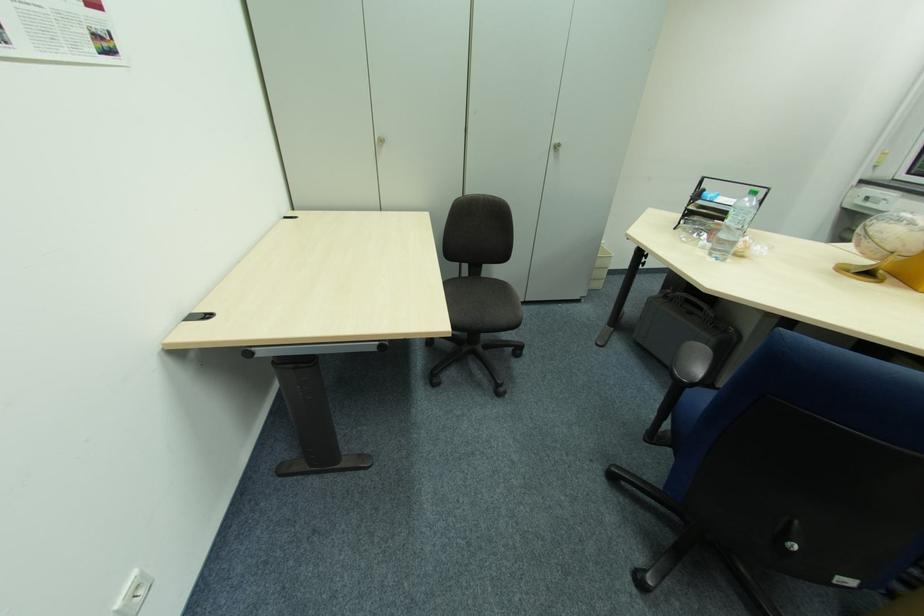
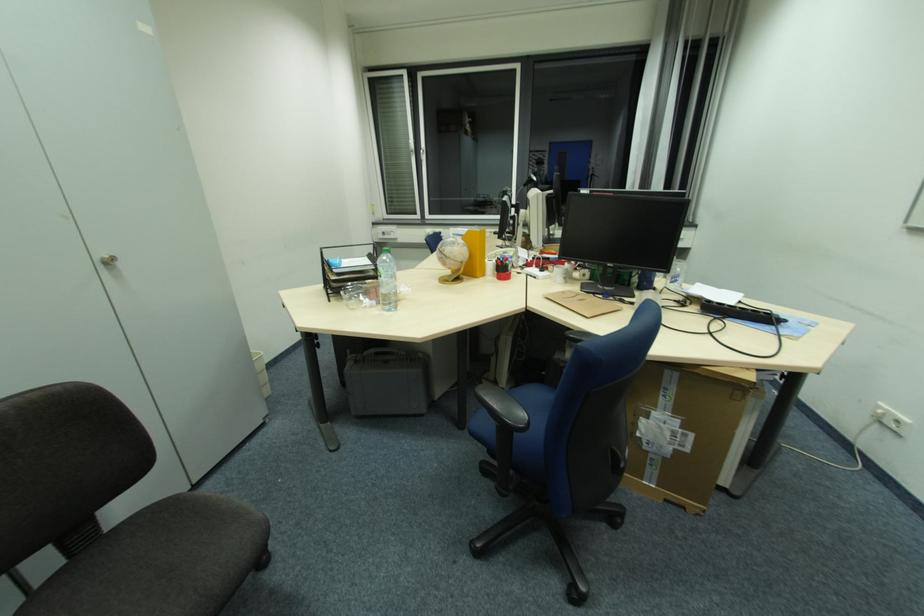
Question: The camera is either moving clockwise (left) or counter-clockwise (right) around the object. The first image is from the beginning of the video and the second image is from the end. Is the camera moving left or right when shooting the video?

Choices:
 (A) Left
 (B) Right

Answer: (A)